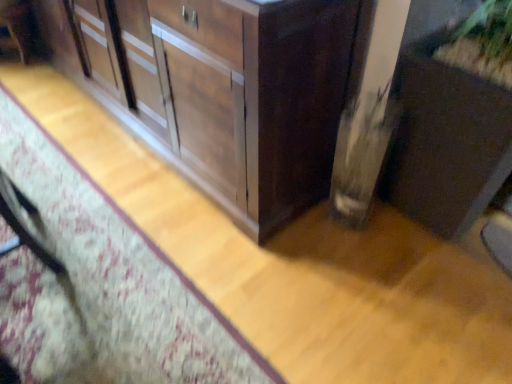
Question: Is wooden cabinet at center, marked as the second cabinetry in a right-to-left arrangement, smaller than matte brown cabinet at lower right, the 2th cabinetry viewed from the left?

Choices:
 (A) yes
 (B) no

Answer: (B)

Question: Considering the relative sizes of wooden cabinet at center, marked as the second cabinetry in a right-to-left arrangement, and matte brown cabinet at lower right, placed as the 1th cabinetry when sorted from right to left, in the image provided, is wooden cabinet at center, marked as the second cabinetry in a right-to-left arrangement, bigger than matte brown cabinet at lower right, placed as the 1th cabinetry when sorted from right to left,?

Choices:
 (A) no
 (B) yes

Answer: (B)

Question: From the image's perspective, does wooden cabinet at center, marked as the second cabinetry in a right-to-left arrangement, appear lower than matte brown cabinet at lower right, the 2th cabinetry viewed from the left?

Choices:
 (A) no
 (B) yes

Answer: (A)

Question: Is wooden cabinet at center, marked as the second cabinetry in a right-to-left arrangement, far from matte brown cabinet at lower right, the 2th cabinetry viewed from the left?

Choices:
 (A) yes
 (B) no

Answer: (B)

Question: Does wooden cabinet at center, which ranks as the 1th cabinetry in left-to-right order, contain matte brown cabinet at lower right, the 2th cabinetry viewed from the left?

Choices:
 (A) no
 (B) yes

Answer: (A)

Question: Is wooden cabinet at center, which ranks as the 1th cabinetry in left-to-right order, to the right of matte brown cabinet at lower right, placed as the 1th cabinetry when sorted from right to left, from the viewer's perspective?

Choices:
 (A) yes
 (B) no

Answer: (B)

Question: Is matte brown cabinet at lower right, the 2th cabinetry viewed from the left, to the left of wooden cabinet at center, marked as the second cabinetry in a right-to-left arrangement, from the viewer's perspective?

Choices:
 (A) yes
 (B) no

Answer: (B)

Question: Does matte brown cabinet at lower right, placed as the 1th cabinetry when sorted from right to left, have a larger size compared to wooden cabinet at center, which ranks as the 1th cabinetry in left-to-right order?

Choices:
 (A) no
 (B) yes

Answer: (A)

Question: From a real-world perspective, is matte brown cabinet at lower right, the 2th cabinetry viewed from the left, on top of wooden cabinet at center, which ranks as the 1th cabinetry in left-to-right order?

Choices:
 (A) yes
 (B) no

Answer: (B)

Question: From the image's perspective, is matte brown cabinet at lower right, placed as the 1th cabinetry when sorted from right to left, located beneath wooden cabinet at center, marked as the second cabinetry in a right-to-left arrangement?

Choices:
 (A) yes
 (B) no

Answer: (A)

Question: From the image's perspective, is matte brown cabinet at lower right, the 2th cabinetry viewed from the left, on wooden cabinet at center, marked as the second cabinetry in a right-to-left arrangement?

Choices:
 (A) yes
 (B) no

Answer: (B)

Question: Does matte brown cabinet at lower right, placed as the 1th cabinetry when sorted from right to left, have a lesser width compared to wooden cabinet at center, marked as the second cabinetry in a right-to-left arrangement?

Choices:
 (A) no
 (B) yes

Answer: (B)

Question: In terms of height, does wooden cabinet at center, marked as the second cabinetry in a right-to-left arrangement, look taller or shorter compared to matte brown cabinet at lower right, the 2th cabinetry viewed from the left?

Choices:
 (A) short
 (B) tall

Answer: (A)